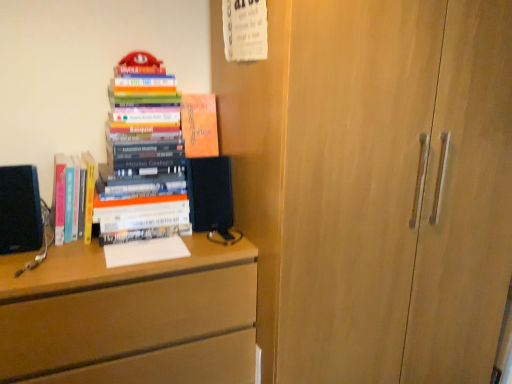
In order to click on black matte speaker at center in this screenshot , I will do `click(210, 192)`.

Image resolution: width=512 pixels, height=384 pixels. What do you see at coordinates (199, 125) in the screenshot? I see `matte orange book at upper center, marked as the 3th book in a left-to-right arrangement` at bounding box center [199, 125].

What do you see at coordinates (119, 305) in the screenshot?
I see `matte wood chest of drawers at left` at bounding box center [119, 305].

Locate an element on the screen. This screenshot has width=512, height=384. hardcover books at left, placed as the 1th book when sorted from left to right is located at coordinates (65, 199).

Which object is thinner, hardcover books at left, the third book from the right, or hardcover books at left, the second book positioned from the left?

hardcover books at left, the third book from the right, is thinner.

Considering the relative sizes of hardcover books at left, the third book from the right, and hardcover books at left, the 2th book viewed from the right, in the image provided, is hardcover books at left, the third book from the right, smaller than hardcover books at left, the 2th book viewed from the right,?

Yes, hardcover books at left, the third book from the right, is smaller than hardcover books at left, the 2th book viewed from the right.

Considering the relative positions of hardcover books at left, placed as the 1th book when sorted from left to right, and hardcover books at left, the 2th book viewed from the right, in the image provided, is hardcover books at left, placed as the 1th book when sorted from left to right, to the right of hardcover books at left, the 2th book viewed from the right, from the viewer's perspective?

Incorrect, hardcover books at left, placed as the 1th book when sorted from left to right, is not on the right side of hardcover books at left, the 2th book viewed from the right.

Which object is further away from the camera, black matte speaker at center or hardcover books at left, the third book from the right?

black matte speaker at center is further away from the camera.

Considering the sizes of objects black matte speaker at center and hardcover books at left, placed as the 1th book when sorted from left to right, in the image provided, who is bigger, black matte speaker at center or hardcover books at left, placed as the 1th book when sorted from left to right,?

Bigger between the two is hardcover books at left, placed as the 1th book when sorted from left to right.

What's the angular difference between black matte speaker at center and hardcover books at left, placed as the 1th book when sorted from left to right,'s facing directions?

They differ by 0.00418 degrees in their facing directions.

Are matte orange book at upper center, marked as the 3th book in a left-to-right arrangement, and matte wood chest of drawers at left making contact?

No, matte orange book at upper center, marked as the 3th book in a left-to-right arrangement, is not beside matte wood chest of drawers at left.

Considering the relative positions of matte orange book at upper center, the first book from the right, and matte wood chest of drawers at left in the image provided, is matte orange book at upper center, the first book from the right, to the right of matte wood chest of drawers at left from the viewer's perspective?

Indeed, matte orange book at upper center, the first book from the right, is positioned on the right side of matte wood chest of drawers at left.

I want to click on book that is the 3rd object located behind the matte wood chest of drawers at left, so click(199, 125).

In the scene shown: From a real-world perspective, is matte orange book at upper center, marked as the 3th book in a left-to-right arrangement, above or below matte wood chest of drawers at left?

In terms of real-world spatial position, matte orange book at upper center, marked as the 3th book in a left-to-right arrangement, is above matte wood chest of drawers at left.

Find the location of `the chest of drawers located in front of the hardcover books at left, the third book from the right`. the chest of drawers located in front of the hardcover books at left, the third book from the right is located at coordinates (119, 305).

From a real-world perspective, is matte wood chest of drawers at left positioned over hardcover books at left, the third book from the right, based on gravity?

No.

Is point (149, 302) closer to camera compared to point (90, 197)?

That is True.

Does matte wood chest of drawers at left turn towards hardcover books at left, the third book from the right?

No, matte wood chest of drawers at left is not turned towards hardcover books at left, the third book from the right.

From a real-world perspective, is hardcover books at left, the third book from the right, positioned over matte wood chest of drawers at left based on gravity?

Indeed, from a real-world perspective, hardcover books at left, the third book from the right, stands above matte wood chest of drawers at left.

From their relative heights in the image, would you say hardcover books at left, placed as the 1th book when sorted from left to right, is taller or shorter than matte wood chest of drawers at left?

hardcover books at left, placed as the 1th book when sorted from left to right, is shorter than matte wood chest of drawers at left.

Considering the sizes of objects hardcover books at left, the third book from the right, and matte wood chest of drawers at left in the image provided, who is thinner, hardcover books at left, the third book from the right, or matte wood chest of drawers at left?

With smaller width is hardcover books at left, the third book from the right.

Is hardcover books at left, the 2th book viewed from the right, bigger than black matte speaker at center?

Yes, hardcover books at left, the 2th book viewed from the right, is bigger than black matte speaker at center.

Is hardcover books at left, the second book positioned from the left, oriented away from black matte speaker at center?

No, hardcover books at left, the second book positioned from the left,'s orientation is not away from black matte speaker at center.

From a real-world perspective, is hardcover books at left, the 2th book viewed from the right, physically above black matte speaker at center?

Yes, from a real-world perspective, hardcover books at left, the 2th book viewed from the right, is above black matte speaker at center.

From the image's perspective, is matte orange book at upper center, the first book from the right, located beneath hardcover books at left, the 2th book viewed from the right?

No, from the image's perspective, matte orange book at upper center, the first book from the right, is not beneath hardcover books at left, the 2th book viewed from the right.

Considering the sizes of objects matte orange book at upper center, the first book from the right, and hardcover books at left, the second book positioned from the left, in the image provided, who is bigger, matte orange book at upper center, the first book from the right, or hardcover books at left, the second book positioned from the left,?

hardcover books at left, the second book positioned from the left.

This screenshot has width=512, height=384. Identify the location of book above the hardcover books at left, the 2th book viewed from the right (from a real-world perspective). (199, 125).

Is matte orange book at upper center, marked as the 3th book in a left-to-right arrangement, not close to hardcover books at left, the second book positioned from the left?

matte orange book at upper center, marked as the 3th book in a left-to-right arrangement, is near hardcover books at left, the second book positioned from the left, not far away.

Identify the location of book below the hardcover books at left, the 2th book viewed from the right (from a real-world perspective). (65, 199).

You are a GUI agent. You are given a task and a screenshot of the screen. Output one action in this format:
    pyautogui.click(x=<x>, y=<y>)
    Task: Click on the speaker located behind the hardcover books at left, placed as the 1th book when sorted from left to right
    
    Given the screenshot: What is the action you would take?
    pyautogui.click(x=210, y=192)

Looking at this image, estimate the real-world distances between objects in this image. Which object is closer to hardcover books at left, placed as the 1th book when sorted from left to right, hardcover books at left, the second book positioned from the left, or matte wood chest of drawers at left?

hardcover books at left, the second book positioned from the left, is closer to hardcover books at left, placed as the 1th book when sorted from left to right.

From the image, which object appears to be nearer to black matte speaker at center, hardcover books at left, placed as the 1th book when sorted from left to right, or matte wood chest of drawers at left?

Based on the image, matte wood chest of drawers at left appears to be nearer to black matte speaker at center.

Looking at the image, which one is located closer to hardcover books at left, placed as the 1th book when sorted from left to right, black matte speaker at center or matte wood chest of drawers at left?

matte wood chest of drawers at left is closer to hardcover books at left, placed as the 1th book when sorted from left to right.

Considering their positions, is hardcover books at left, the second book positioned from the left, positioned closer to black matte speaker at center than matte orange book at upper center, marked as the 3th book in a left-to-right arrangement?

The object closer to black matte speaker at center is hardcover books at left, the second book positioned from the left.

Based on their spatial positions, is matte wood chest of drawers at left or black matte speaker at center closer to matte orange book at upper center, marked as the 3th book in a left-to-right arrangement?

black matte speaker at center is positioned closer to the anchor matte orange book at upper center, marked as the 3th book in a left-to-right arrangement.

From the image, which object appears to be nearer to hardcover books at left, the third book from the right, matte wood chest of drawers at left or hardcover books at left, the second book positioned from the left?

hardcover books at left, the second book positioned from the left, is positioned closer to the anchor hardcover books at left, the third book from the right.

When comparing their distances from matte wood chest of drawers at left, does matte orange book at upper center, the first book from the right, or hardcover books at left, placed as the 1th book when sorted from left to right, seem closer?

hardcover books at left, placed as the 1th book when sorted from left to right, is positioned closer to the anchor matte wood chest of drawers at left.

From the picture: Based on their spatial positions, is black matte speaker at center or matte wood chest of drawers at left closer to matte orange book at upper center, marked as the 3th book in a left-to-right arrangement?

The object closer to matte orange book at upper center, marked as the 3th book in a left-to-right arrangement, is black matte speaker at center.

This screenshot has width=512, height=384. I want to click on speaker between matte orange book at upper center, the first book from the right, and matte wood chest of drawers at left from top to bottom, so point(210,192).

Identify the location of speaker that lies between hardcover books at left, the 2th book viewed from the right, and matte wood chest of drawers at left from top to bottom. (210, 192).

At what (x,y) coordinates should I click in order to perform the action: click on book between hardcover books at left, the 2th book viewed from the right, and matte wood chest of drawers at left in the up-down direction. Please return your answer as a coordinate pair (x, y). The image size is (512, 384). Looking at the image, I should click on (65, 199).

Identify the location of book between hardcover books at left, the third book from the right, and matte orange book at upper center, marked as the 3th book in a left-to-right arrangement. The width and height of the screenshot is (512, 384). click(x=142, y=135).